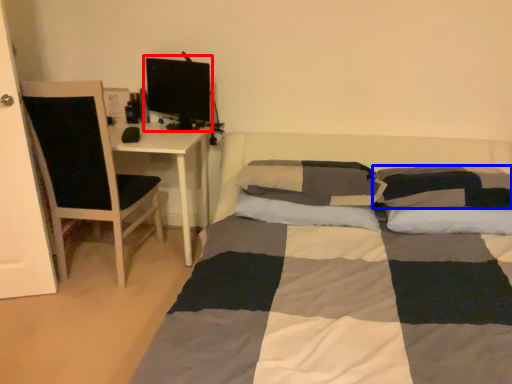
Question: Which of the following is the closest to the observer, computer monitor (highlighted by a red box) or pillow (highlighted by a blue box)?

Choices:
 (A) computer monitor
 (B) pillow

Answer: (B)